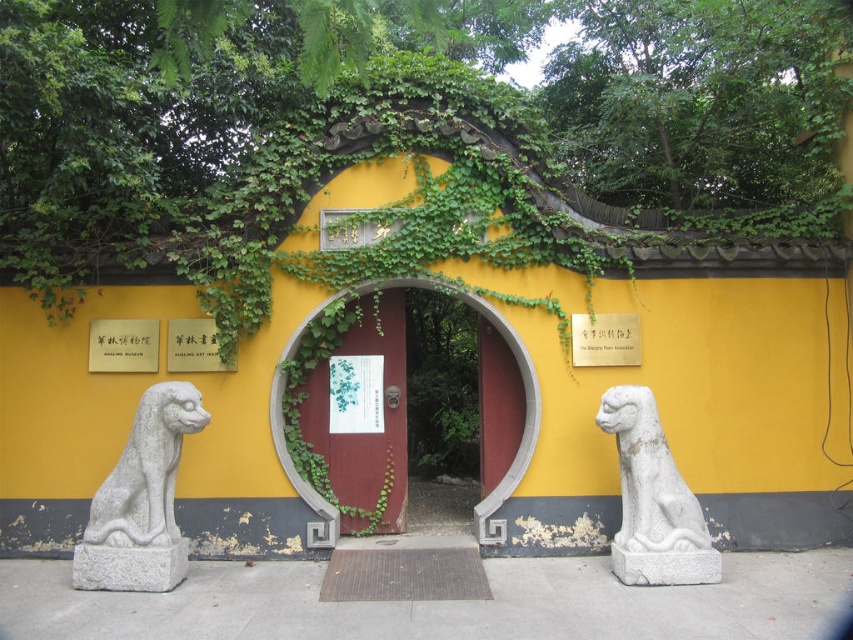
Question: Can you confirm if green ivy at center is positioned above matte gold plaque at center?

Choices:
 (A) yes
 (B) no

Answer: (A)

Question: Which point is farther from the camera taking this photo?

Choices:
 (A) (202, 348)
 (B) (346, 227)
 (C) (71, 568)

Answer: (B)

Question: Which object is farther from the camera taking this photo?

Choices:
 (A) green ivy at center
 (B) white stone lion at right
 (C) white paper at center
 (D) matte gold plaque at center

Answer: (A)

Question: Where is white stone lion at right located in relation to white paper at center in the image?

Choices:
 (A) above
 (B) below

Answer: (B)

Question: Can you confirm if green ivy at center is thinner than white paper at center?

Choices:
 (A) no
 (B) yes

Answer: (A)

Question: Which of the following is the farthest from the observer?

Choices:
 (A) (334, 426)
 (B) (231, 362)
 (C) (115, 337)
 (D) (515, 333)

Answer: (A)